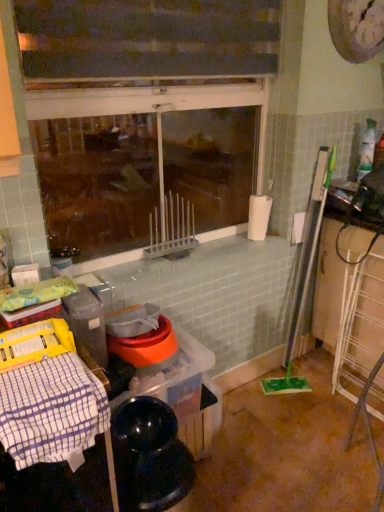
You are a GUI agent. You are given a task and a screenshot of the screen. Output one action in this format:
    pyautogui.click(x=<x>, y=<y>)
    Task: Click on the free spot above white checkered cloth at lower left (from a real-world perspective)
    The width and height of the screenshot is (384, 512).
    Given the screenshot: What is the action you would take?
    pyautogui.click(x=43, y=385)